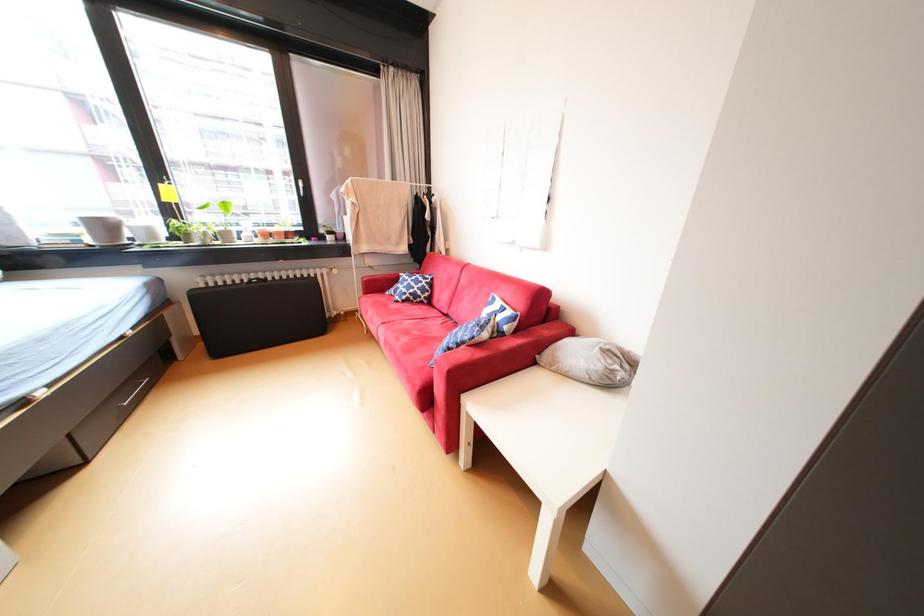
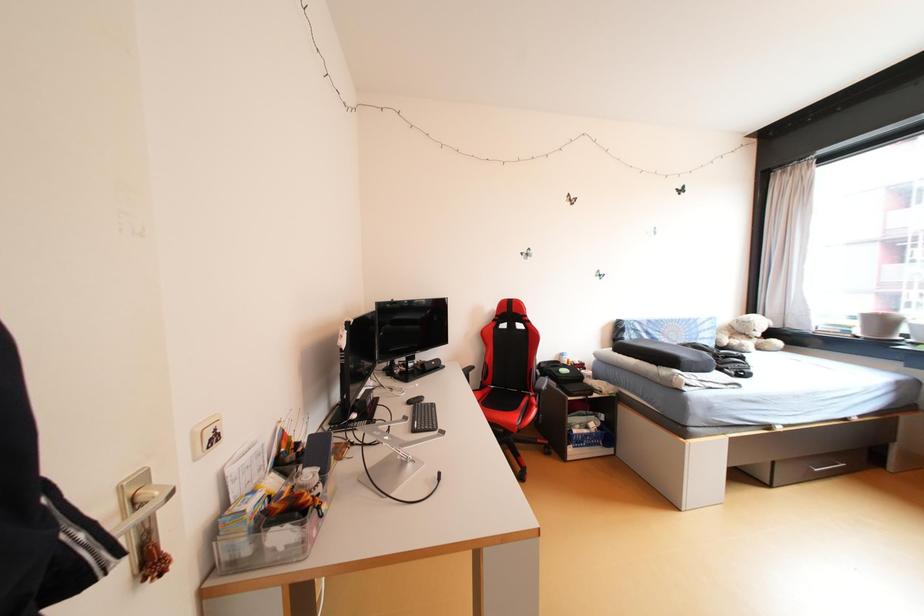
Question: The first image is from the beginning of the video and the second image is from the end. How did the camera likely rotate when shooting the video?

Choices:
 (A) Left
 (B) Right
 (C) Up
 (D) Down

Answer: (A)